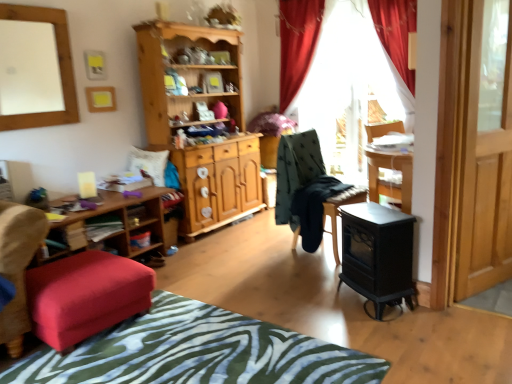
Question: In terms of size, does transparent glass door at right appear bigger or smaller than white matte mirror at upper left?

Choices:
 (A) small
 (B) big

Answer: (B)

Question: Would you say transparent glass door at right is to the left or to the right of white matte mirror at upper left in the picture?

Choices:
 (A) right
 (B) left

Answer: (A)

Question: Which is nearer to the transparent glass door at right?

Choices:
 (A) wooden shelf at lower left
 (B) velvet red ottoman at lower left
 (C) red velvet curtain at upper center
 (D) wooden shelf at lower left
 (E) wooden cabinet at center

Answer: (B)

Question: Which object is the farthest from the zebra print fabric at lower center?

Choices:
 (A) wooden shelf at lower left
 (B) transparent glass door at right
 (C) red velvet curtain at upper center
 (D) velvet red ottoman at lower left
 (E) dark green fabric chair at center

Answer: (C)